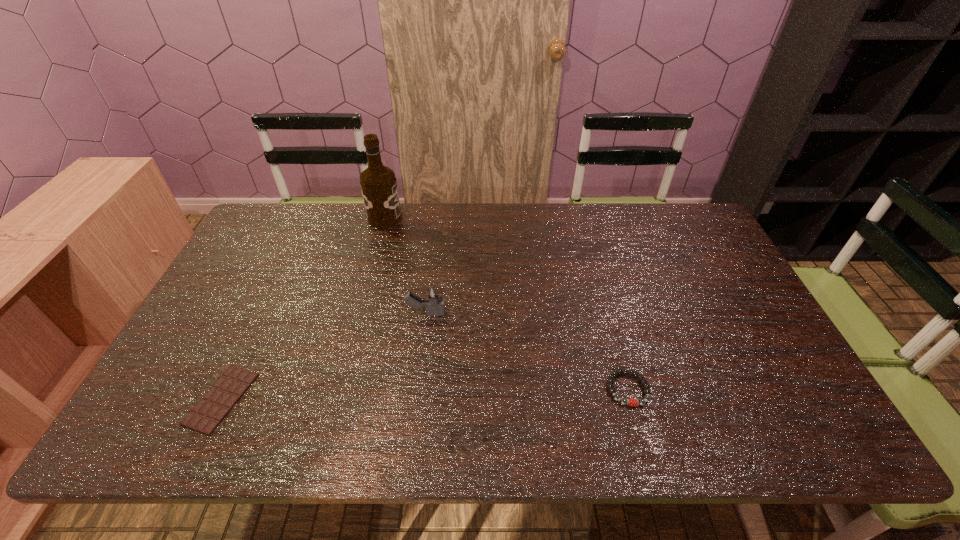
Locate an element on the screen. The height and width of the screenshot is (540, 960). free space at the far right corner is located at coordinates (674, 225).

Locate an element on the screen. This screenshot has width=960, height=540. vacant position at the near right corner of the desktop is located at coordinates (767, 433).

What are the coordinates of `free space between the third nearest object and the third tallest object` in the screenshot? It's located at pos(527,352).

Find the location of `unoccupied area between the shortest object and the third shortest object`. unoccupied area between the shortest object and the third shortest object is located at coordinates (324, 356).

Where is `empty space that is in between the bracelet and the third object from right to left`? empty space that is in between the bracelet and the third object from right to left is located at coordinates (506, 304).

At what (x,y) coordinates should I click in order to perform the action: click on free space that is in between the igniter and the rightmost object. Please return your answer as a coordinate pair (x, y). Image resolution: width=960 pixels, height=540 pixels. Looking at the image, I should click on (527, 352).

The height and width of the screenshot is (540, 960). Identify the location of vacant area that lies between the second farthest object and the leftmost object. click(x=324, y=356).

This screenshot has height=540, width=960. I want to click on empty space that is in between the second tallest object and the rightmost object, so click(527, 352).

The image size is (960, 540). Identify the location of free area in between the tallest object and the bracelet. (506, 304).

Locate an element on the screen. The height and width of the screenshot is (540, 960). vacant area that lies between the leftmost object and the rightmost object is located at coordinates (x=424, y=394).